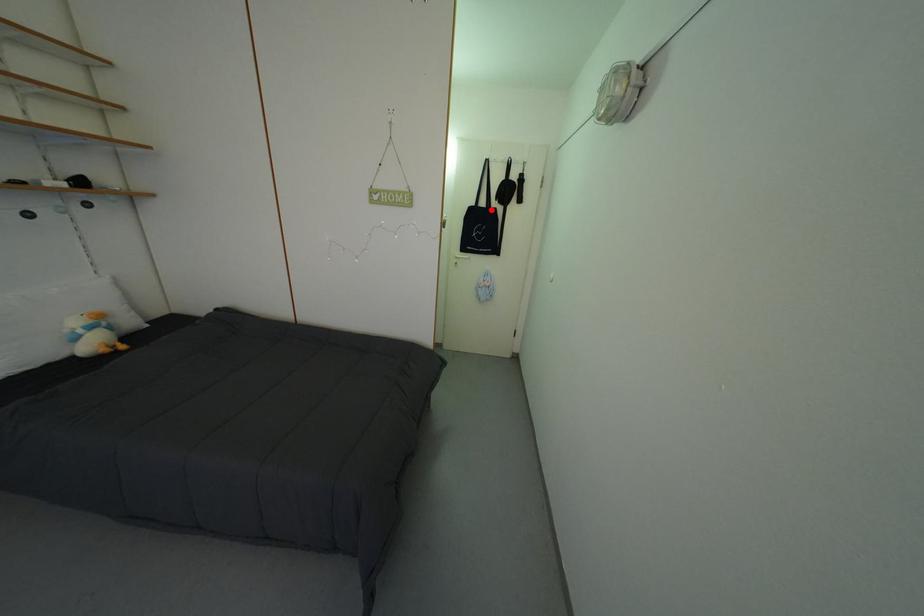
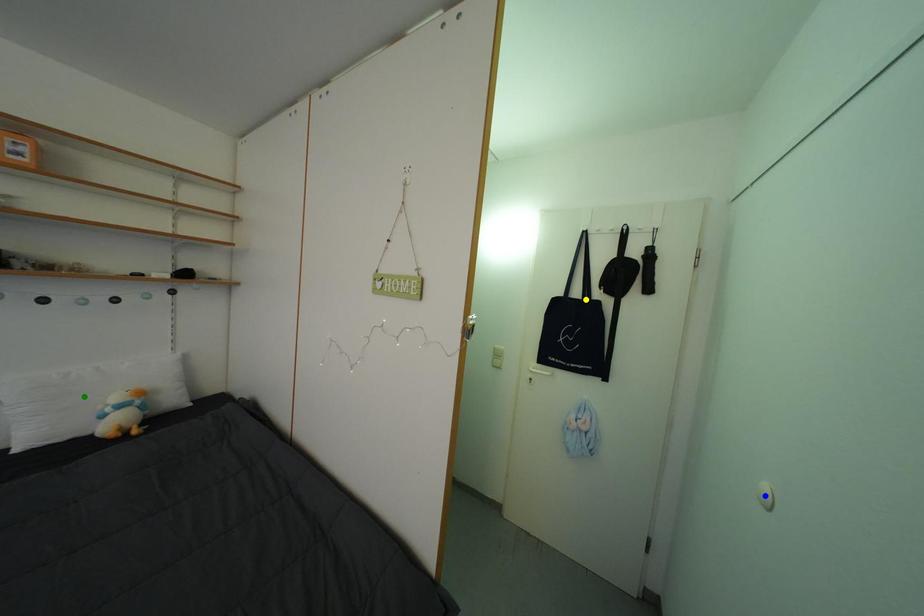
Question: I am providing you with two images of the same scene from different viewpoints. A red point is marked on the first image. You are given multiple points on the second image. Which spot in image 2 lines up with the point in image 1?

Choices:
 (A) green point
 (B) blue point
 (C) yellow point

Answer: (C)